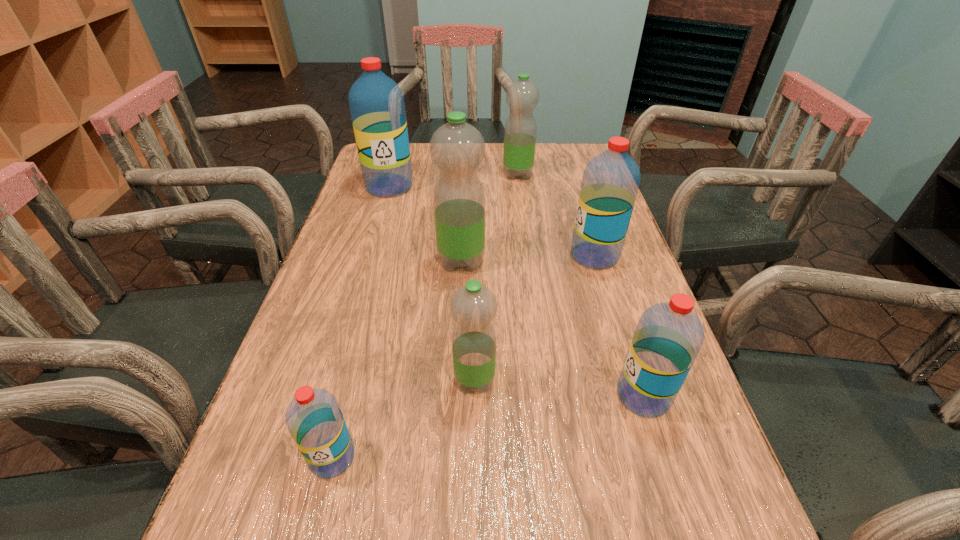
This screenshot has width=960, height=540. What are the coordinates of `empty space that is in between the second farthest green water bottle and the biggest red water bottle` in the screenshot? It's located at (425, 223).

You are a GUI agent. You are given a task and a screenshot of the screen. Output one action in this format:
    pyautogui.click(x=<x>, y=<y>)
    Task: Click on the free spot between the second nearest red water bottle and the nearest green water bottle
    This screenshot has height=540, width=960.
    Given the screenshot: What is the action you would take?
    pyautogui.click(x=559, y=388)

Where is `vacant region between the farthest green water bottle and the smallest red water bottle`? The height and width of the screenshot is (540, 960). vacant region between the farthest green water bottle and the smallest red water bottle is located at coordinates (425, 316).

The width and height of the screenshot is (960, 540). What are the coordinates of `free space between the third smallest red water bottle and the second nearest green water bottle` in the screenshot? It's located at pos(528,258).

Identify which object is the fourth closest to the second farthest green water bottle. Please provide its 2D coordinates. Your answer should be formatted as a tuple, i.e. [(x, y)], where the tuple contains the x and y coordinates of a point satisfying the conditions above.

[(522, 96)]

Locate which object is the third closest to the smallest green water bottle. Please provide its 2D coordinates. Your answer should be formatted as a tuple, i.e. [(x, y)], where the tuple contains the x and y coordinates of a point satisfying the conditions above.

[(457, 148)]

Where is `the sixth closest water bottle to the fifth object from left to right`? This screenshot has height=540, width=960. the sixth closest water bottle to the fifth object from left to right is located at coordinates (313, 417).

Where is `water bottle that is the fifth closest to the third smallest red water bottle`? water bottle that is the fifth closest to the third smallest red water bottle is located at coordinates (376, 102).

Locate an element on the screen. red water bottle that is the third closest to the shortest object is located at coordinates (376, 102).

Locate which red water bottle is the closest to the second nearest red water bottle. Please provide its 2D coordinates. Your answer should be formatted as a tuple, i.e. [(x, y)], where the tuple contains the x and y coordinates of a point satisfying the conditions above.

[(610, 183)]